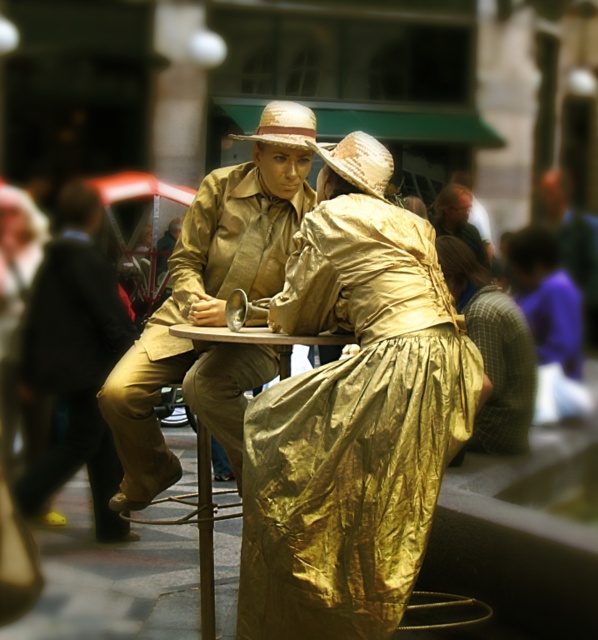
Question: Which object appears farthest from the camera in this image?

Choices:
 (A) matte khaki jacket at center
 (B) strawmaterial/texturehat at upper center
 (C) gold shiny dress at center
 (D) gold foil dress at center

Answer: (D)

Question: Where is matte khaki jacket at center located in relation to strawmaterial/texturehat at upper center in the image?

Choices:
 (A) right
 (B) left

Answer: (B)

Question: Which point is closer to the camera taking this photo?

Choices:
 (A) (454, 225)
 (B) (38, 340)
 (C) (254, 140)

Answer: (C)

Question: Which of the following is the closest to the observer?

Choices:
 (A) gold foil dress at center
 (B) strawmaterial/texturehat at upper center
 (C) matte khaki jacket at center

Answer: (B)

Question: Can you confirm if gold metallic dress at center is bigger than gold foil dress at center?

Choices:
 (A) yes
 (B) no

Answer: (B)

Question: Is gold shiny dress at center smaller than gold foil dress at center?

Choices:
 (A) yes
 (B) no

Answer: (A)